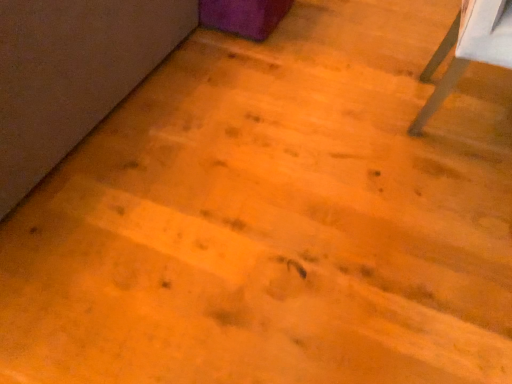
What is the approximate height of wooden table at right?

The height of wooden table at right is 20.67 inches.

Identify the location of wooden table at right. (468, 49).

Describe the element at coordinates (468, 49) in the screenshot. The height and width of the screenshot is (384, 512). I see `wooden table at right` at that location.

Find the location of a particular element. wooden table at right is located at coordinates (468, 49).